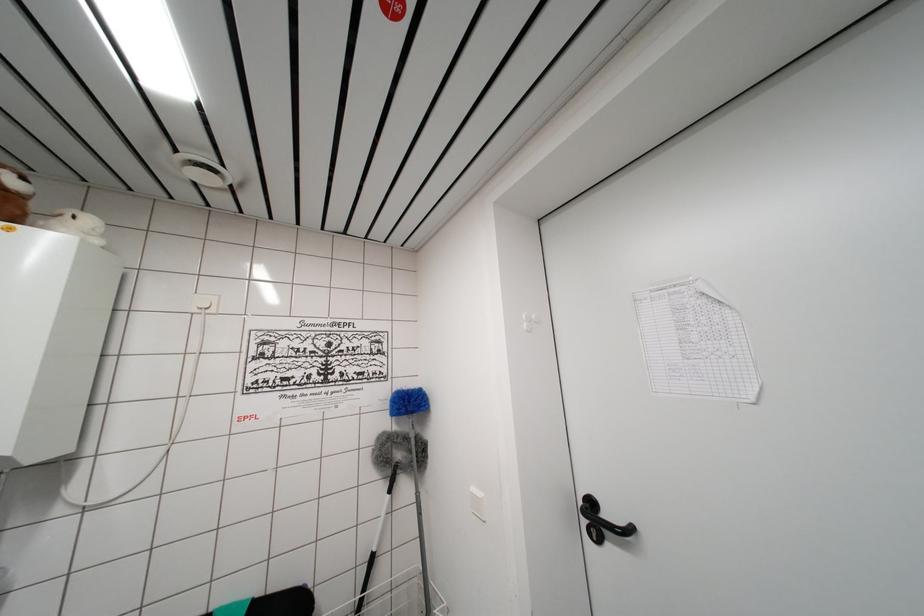
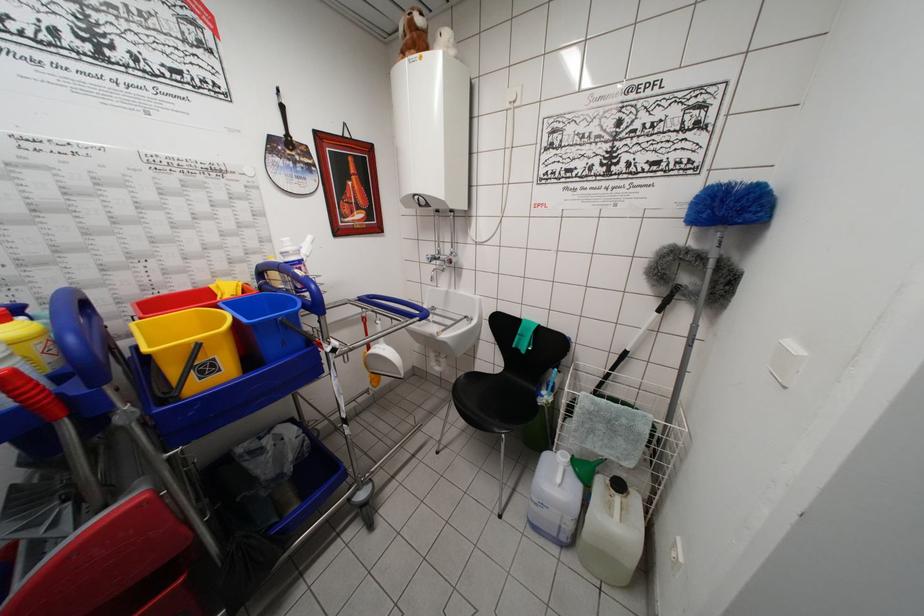
Locate, in the second image, the point that corresponds to the point at 409,402 in the first image.

(723, 199)